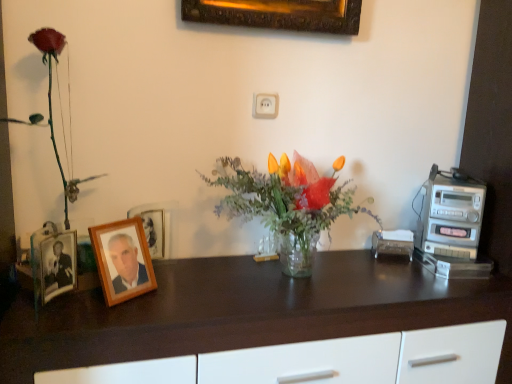
Identify the location of blank space above dark wood desk at center (from a real-world perspective). (290, 288).